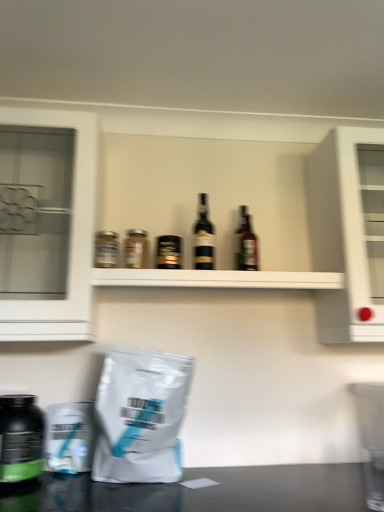
Question: Is point (137, 262) closer or farther from the camera than point (243, 224)?

Choices:
 (A) closer
 (B) farther

Answer: (A)

Question: From a real-world perspective, is matte glass jar at center, which is the 3th bottle from left to right, above or below brown glass bottle at center, which appears as the 1th bottle when viewed from the right?

Choices:
 (A) above
 (B) below

Answer: (B)

Question: Which is nearer to the black glass bottle at center, acting as the 5th bottle starting from the left?

Choices:
 (A) metallic silver jar at upper left, positioned as the second bottle in left-to-right order
 (B) matte glass jar at center, which is the fourth bottle in right-to-left order
 (C) black matte bottle at center, placed as the third bottle when sorted from right to left
 (D) white matte grocery bag at lower left
 (E) white glossy cabinet at upper right, which is the first cabinetry in right-to-left order

Answer: (C)

Question: Estimate the real-world distances between objects in this image. Which object is closer to the matte glass jar at center, which is the fourth bottle in right-to-left order?

Choices:
 (A) brown glass bottle at center, which appears as the sixth bottle when viewed from the left
 (B) white matte grocery bag at lower left
 (C) black matte bottle at center, which is counted as the 4th bottle, starting from the left
 (D) black glass bottle at center, acting as the 5th bottle starting from the left
 (E) white glossy cabinet at upper right, which is the first cabinetry in right-to-left order

Answer: (C)